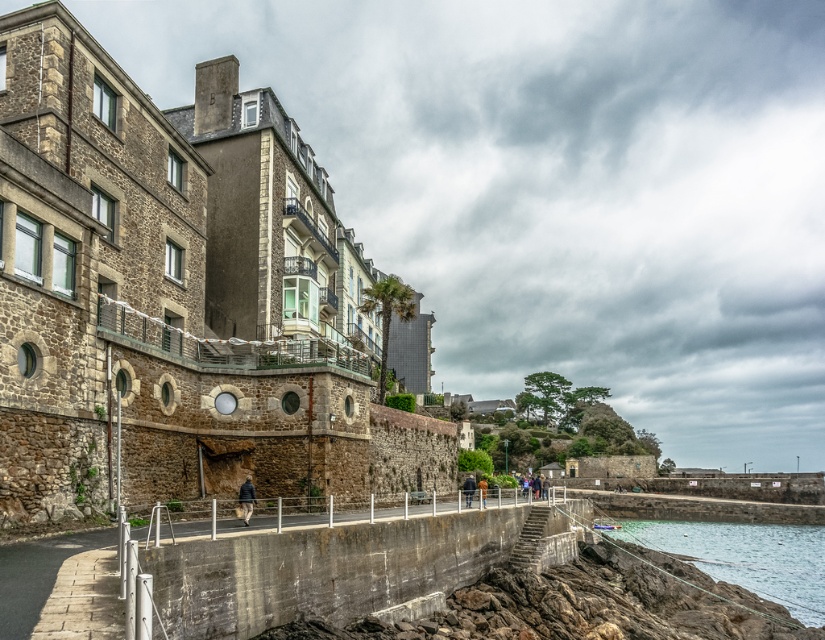
At what (x,y) coordinates should I click in order to perform the action: click on clear water at lower right. Please return your answer as a coordinate pair (x, y). The width and height of the screenshot is (825, 640). Looking at the image, I should click on (746, 557).

Can you confirm if clear water at lower right is shorter than brown leather jacket at center?

No, clear water at lower right is not shorter than brown leather jacket at center.

Between point (724, 534) and point (469, 492), which one is positioned in front?

Point (469, 492) is in front.

Identify the location of clear water at lower right. (746, 557).

Is point (468, 502) positioned in front of point (481, 497)?

No, (468, 502) is further to viewer.

Which is behind, point (467, 481) or point (482, 477)?

The point (482, 477) is behind.

Locate an element on the screen. brown leather jacket at center is located at coordinates (468, 490).

Is clear water at lower right smaller than khaki fabric pants at lower center?

Incorrect, clear water at lower right is not smaller in size than khaki fabric pants at lower center.

Who is lower down, clear water at lower right or khaki fabric pants at lower center?

clear water at lower right is below.

Identify the location of clear water at lower right. The width and height of the screenshot is (825, 640). (746, 557).